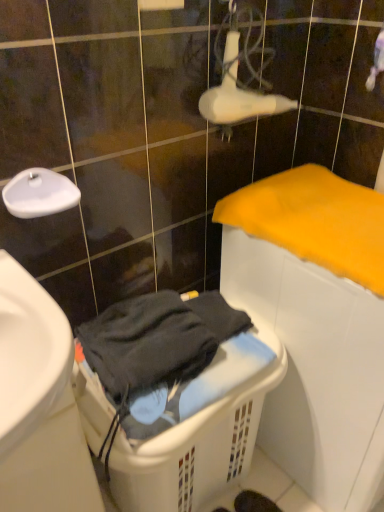
Question: Is point (198, 315) closer or farther from the camera than point (374, 212)?

Choices:
 (A) farther
 (B) closer

Answer: (B)

Question: Would you say white plastic laundry basket at lower center is to the left or to the right of yellow soft cloth at right in the picture?

Choices:
 (A) left
 (B) right

Answer: (A)

Question: Estimate the real-world distances between objects in this image. Which object is closer to the white glossy faucet at upper left?

Choices:
 (A) white plastic laundry basket at lower center
 (B) yellow soft cloth at right

Answer: (A)

Question: Estimate the real-world distances between objects in this image. Which object is closer to the yellow soft cloth at right?

Choices:
 (A) white plastic laundry basket at lower center
 (B) white glossy faucet at upper left

Answer: (A)